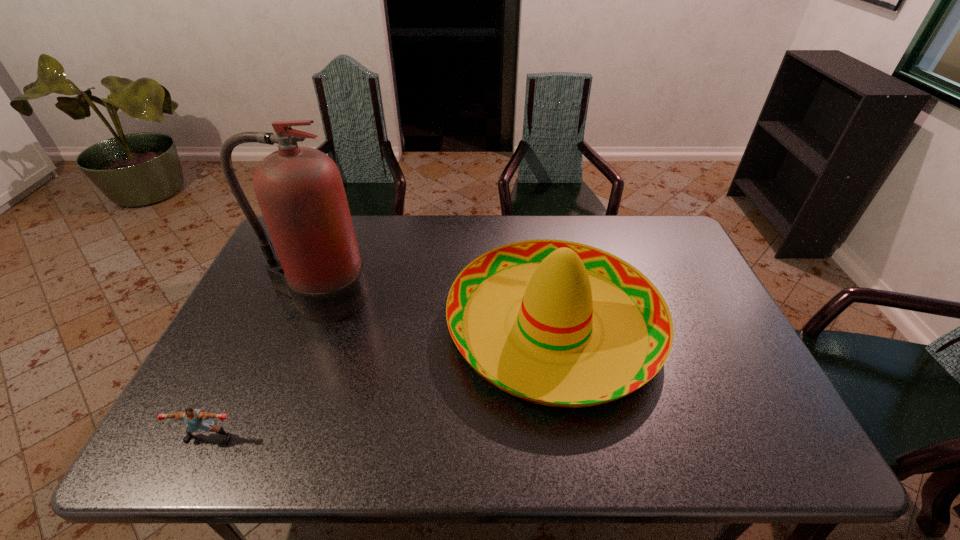
I want to click on fire extinguisher, so click(x=300, y=191).

This screenshot has height=540, width=960. I want to click on the rightmost object, so (591, 328).

Find the location of a particular element. The height and width of the screenshot is (540, 960). the second tallest object is located at coordinates (591, 328).

Where is `the nearest object`? the nearest object is located at coordinates (196, 419).

Identify the location of the shortest object. (196, 419).

Identify the location of free space located at the nozzle of the tallest object. (252, 462).

At what (x,y) coordinates should I click in order to perform the action: click on vacant region located on the left of the second tallest object. Please return your answer as a coordinate pair (x, y). Looking at the image, I should click on (419, 326).

Image resolution: width=960 pixels, height=540 pixels. What are the coordinates of `object located in the near edge section of the desktop` in the screenshot? It's located at (196, 419).

Locate an element on the screen. Image resolution: width=960 pixels, height=540 pixels. fire extinguisher situated at the left edge is located at coordinates (300, 191).

This screenshot has height=540, width=960. I want to click on puncher located at the left edge, so click(196, 419).